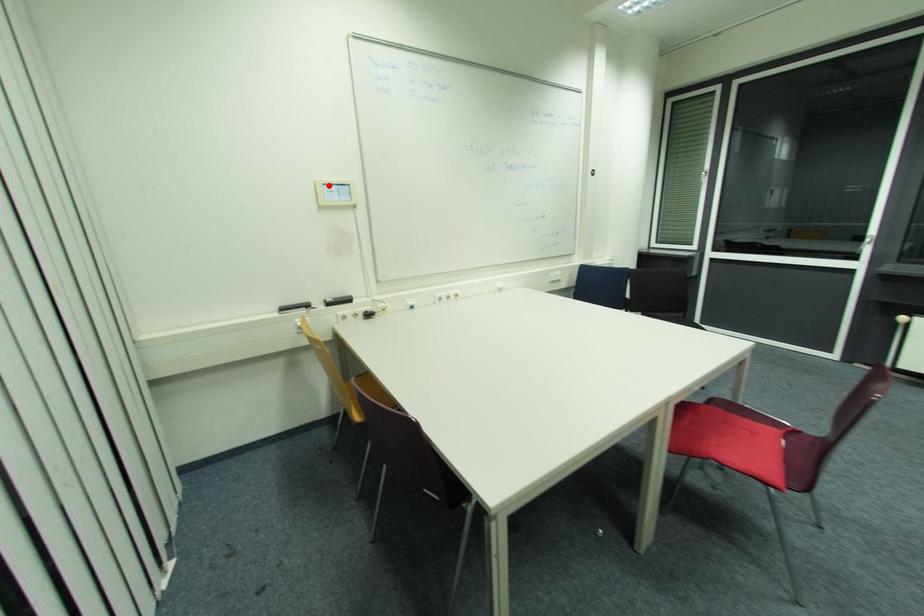
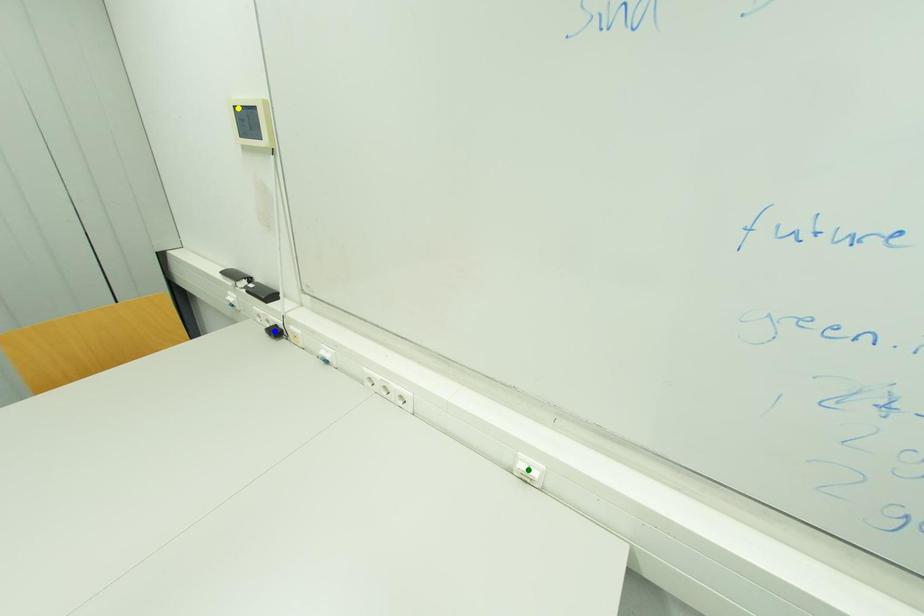
Question: I am providing you with two images of the same scene from different viewpoints. A red point is marked on the first image. You are given multiple points on the second image. Which spot in image 2 lines up with the point in image 1?

Choices:
 (A) yellow point
 (B) green point
 (C) blue point

Answer: (A)